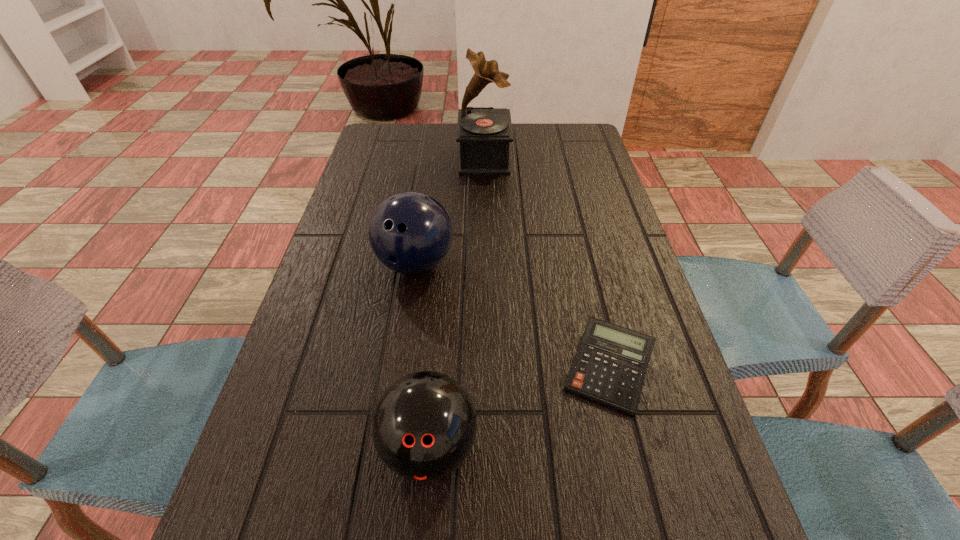
Find the location of a particular element. vacant area situated 0.300m on the surface of the third nearest object near the finger holes is located at coordinates (391, 423).

Where is `blank area located 0.380m on the left of the calculator`? This screenshot has width=960, height=540. blank area located 0.380m on the left of the calculator is located at coordinates (354, 368).

Where is `object at the far edge`? This screenshot has width=960, height=540. object at the far edge is located at coordinates (484, 133).

The image size is (960, 540). What are the coordinates of `object at the left edge` in the screenshot? It's located at (410, 232).

This screenshot has height=540, width=960. I want to click on object at the right edge, so click(x=609, y=368).

In the image, there is a desktop. In order to click on vacant space at the far edge in this screenshot , I will do `click(444, 153)`.

You are a GUI agent. You are given a task and a screenshot of the screen. Output one action in this format:
    pyautogui.click(x=<x>, y=<y>)
    Task: Click on the vacant point at the left edge
    This screenshot has height=540, width=960.
    Given the screenshot: What is the action you would take?
    pos(319,342)

Where is `vacant space at the right edge`? This screenshot has width=960, height=540. vacant space at the right edge is located at coordinates (653, 492).

Where is `free location at the far left corner`? The image size is (960, 540). free location at the far left corner is located at coordinates (395, 148).

Identify the location of free spot between the shortest object and the nearer bowling ball. This screenshot has height=540, width=960. (519, 408).